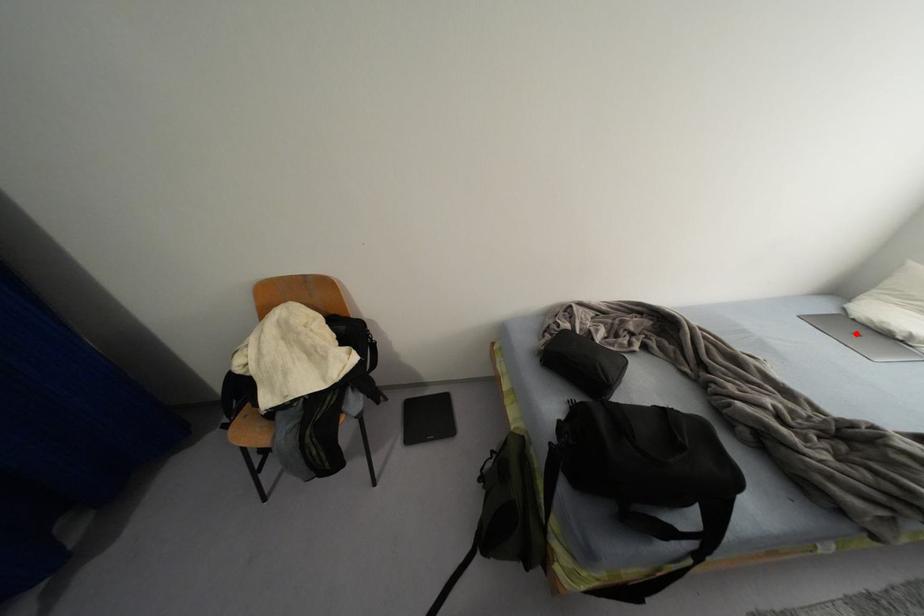
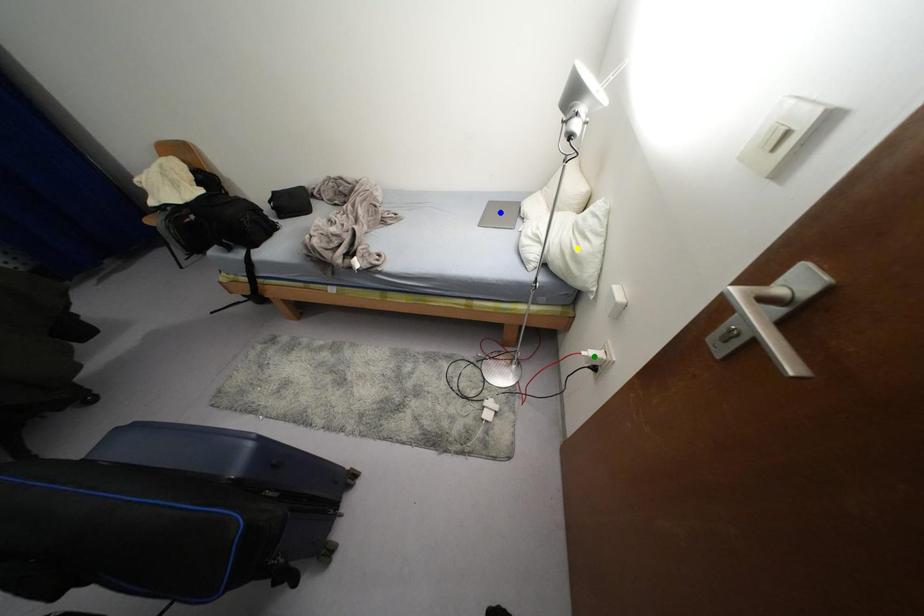
Question: I am providing you with two images of the same scene from different viewpoints. A red point is marked on the first image. You are given multiple points on the second image. Which mark in image 2 goes with the point in image 1?

Choices:
 (A) yellow point
 (B) blue point
 (C) green point

Answer: (B)